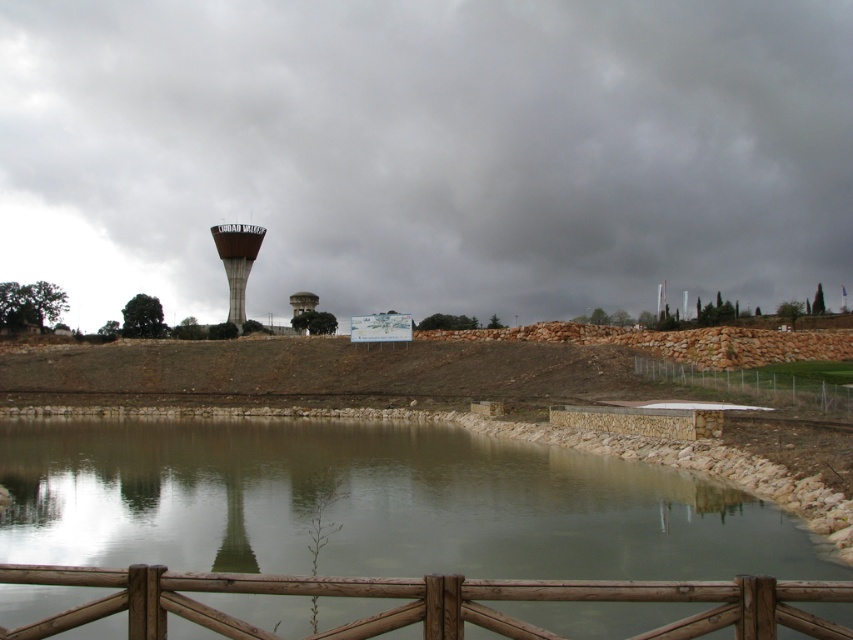
Question: Does white wire mesh fence at lower right have a lesser width compared to metallic gray water tower at center?

Choices:
 (A) no
 (B) yes

Answer: (A)

Question: Which object is closer to the camera taking this photo?

Choices:
 (A) transparent water at center
 (B) white wire mesh fence at lower right
 (C) brown wooden rail at lower center
 (D) metallic gray water tower at center

Answer: (C)

Question: Does brown wooden rail at lower center have a greater width compared to metallic gray water tower at center?

Choices:
 (A) yes
 (B) no

Answer: (A)

Question: Which of these objects is positioned closest to the metallic gray water tower at center?

Choices:
 (A) transparent water at center
 (B) brown wooden rail at lower center
 (C) white wire mesh fence at lower right

Answer: (A)

Question: Does white wire mesh fence at lower right have a greater width compared to metallic gray water tower at center?

Choices:
 (A) yes
 (B) no

Answer: (A)

Question: Estimate the real-world distances between objects in this image. Which object is farther from the transparent water at center?

Choices:
 (A) brown wooden rail at lower center
 (B) white wire mesh fence at lower right
 (C) metallic gray water tower at center

Answer: (C)